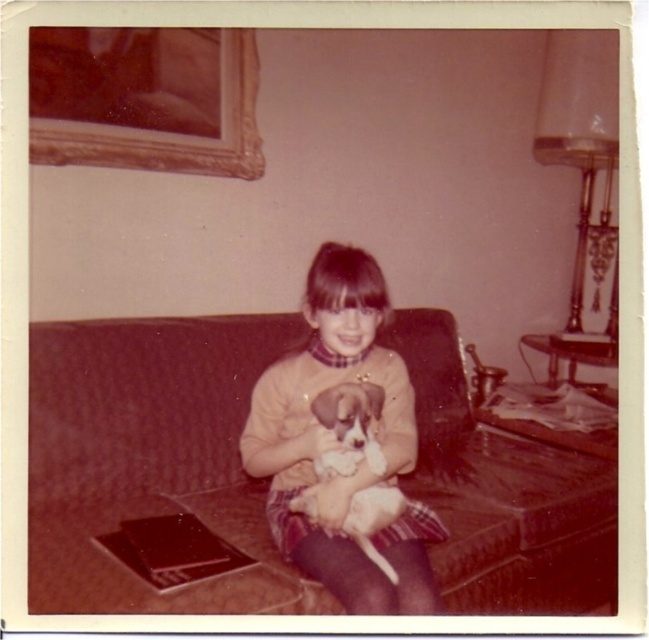
Question: Is brown fabric couch at center smaller than white fur dog at center?

Choices:
 (A) no
 (B) yes

Answer: (A)

Question: Which point is closer to the camera taking this photo?

Choices:
 (A) (349, 284)
 (B) (435, 356)
 (C) (361, 490)

Answer: (A)

Question: Which point is farther to the camera?

Choices:
 (A) brown fabric couch at center
 (B) matte yellow sweater at center

Answer: (A)

Question: Which object appears closest to the camera in this image?

Choices:
 (A) matte yellow sweater at center
 (B) goldwooden frame at upper left
 (C) brown fabric couch at center
 (D) white fur dog at center

Answer: (A)

Question: Does brown fabric couch at center appear on the left side of white fur dog at center?

Choices:
 (A) no
 (B) yes

Answer: (A)

Question: Does brown fabric couch at center have a larger size compared to goldwooden frame at upper left?

Choices:
 (A) yes
 (B) no

Answer: (A)